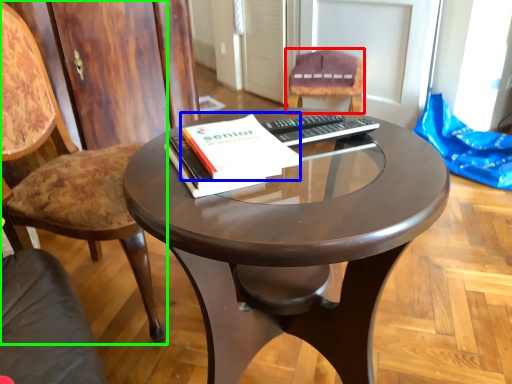
Question: Which is nearer to the chair (highlighted by a red box)? paperback book (highlighted by a blue box) or chair (highlighted by a green box).

Choices:
 (A) paperback book
 (B) chair

Answer: (B)